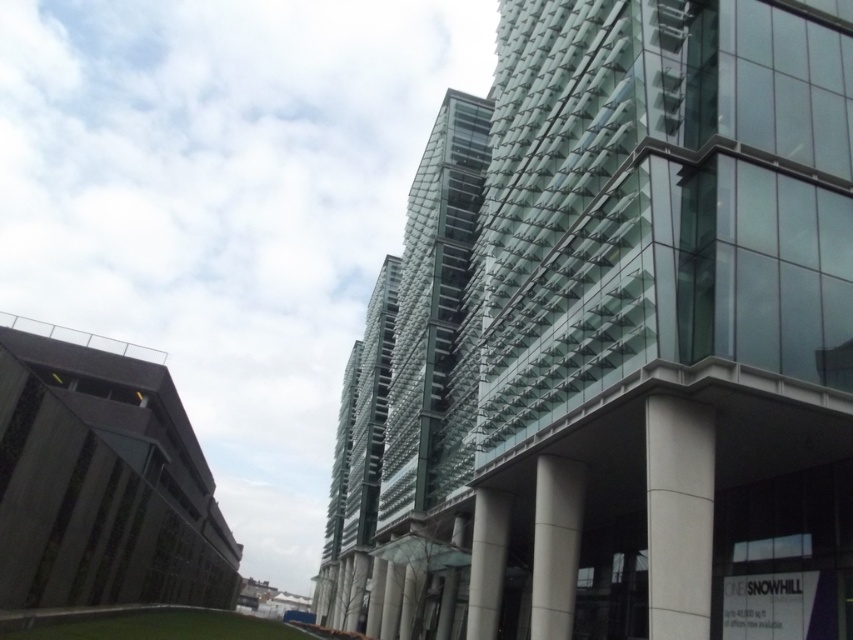
Can you confirm if white smooth pillar at center is smaller than white glossy pillar at center?

No, white smooth pillar at center is not smaller than white glossy pillar at center.

Is point (534, 563) farther from camera compared to point (467, 625)?

No, it is in front of (467, 625).

What do you see at coordinates (555, 545) in the screenshot? I see `white smooth pillar at center` at bounding box center [555, 545].

This screenshot has height=640, width=853. I want to click on white smooth pillar at center, so pos(555,545).

Describe the element at coordinates (621, 330) in the screenshot. I see `transparent glass building at center` at that location.

Does transparent glass building at center appear under white glossy pillar at center?

Actually, transparent glass building at center is above white glossy pillar at center.

You are a GUI agent. You are given a task and a screenshot of the screen. Output one action in this format:
    pyautogui.click(x=<x>, y=<y>)
    Task: Click on the transparent glass building at center
    This screenshot has width=853, height=640.
    Given the screenshot: What is the action you would take?
    pyautogui.click(x=621, y=330)

Between white concrete pillar at lower right and white glossy pillar at center, which one appears on the right side from the viewer's perspective?

Positioned to the right is white concrete pillar at lower right.

Describe the element at coordinates (677, 515) in the screenshot. This screenshot has width=853, height=640. I see `white concrete pillar at lower right` at that location.

Where is `white concrete pillar at lower right`? white concrete pillar at lower right is located at coordinates (677, 515).